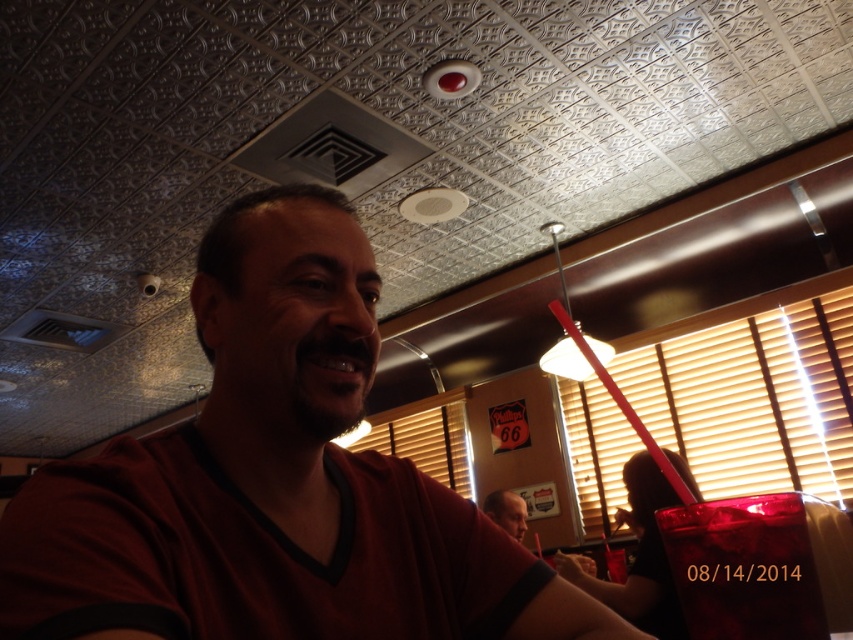
You are trying to decide which shirt to wear for a casual dinner. You have a matte red shirt at center and a matte black shirt at center. Based on the image, which shirt appears to be wider?

The matte red shirt at center might be wider than the matte black shirt at center according to the image.

You are a photographer setting up a shoot in the diner. You have a matte black shirt at center and a translucent plastic cup at lower right in your frame. Which object is wider?

The translucent plastic cup at lower right is wider than the matte black shirt at center.